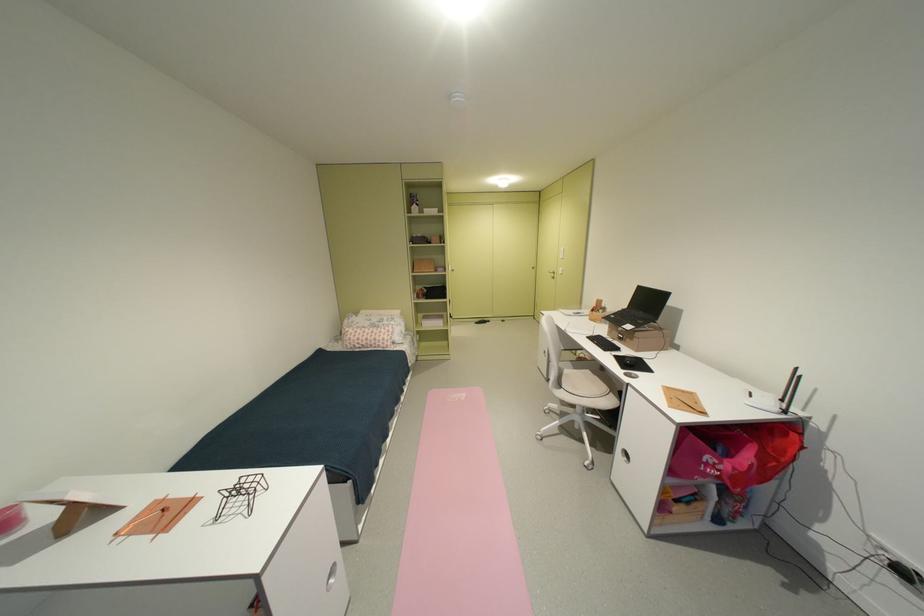
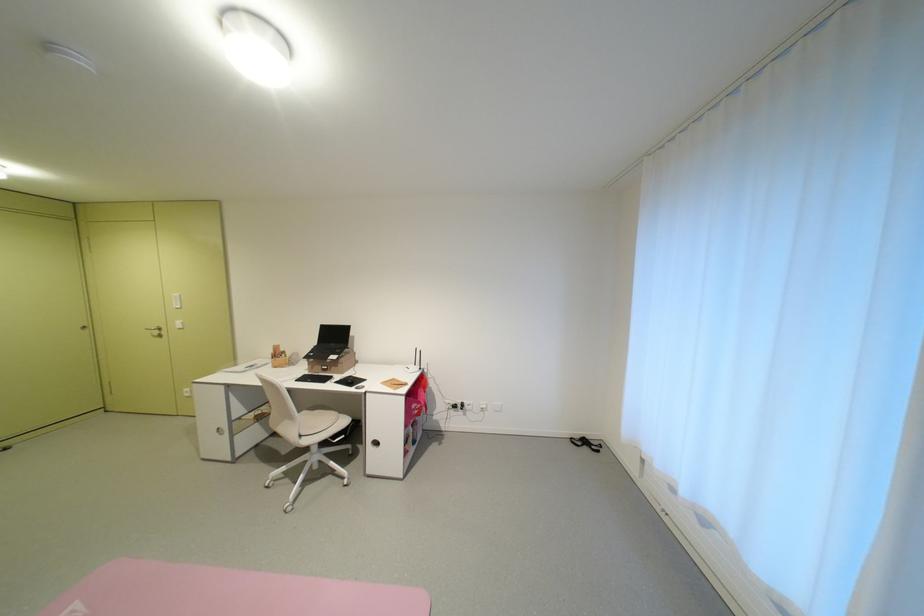
Find the pixel in the second image that matches the point at 611,312 in the first image.

(293, 357)